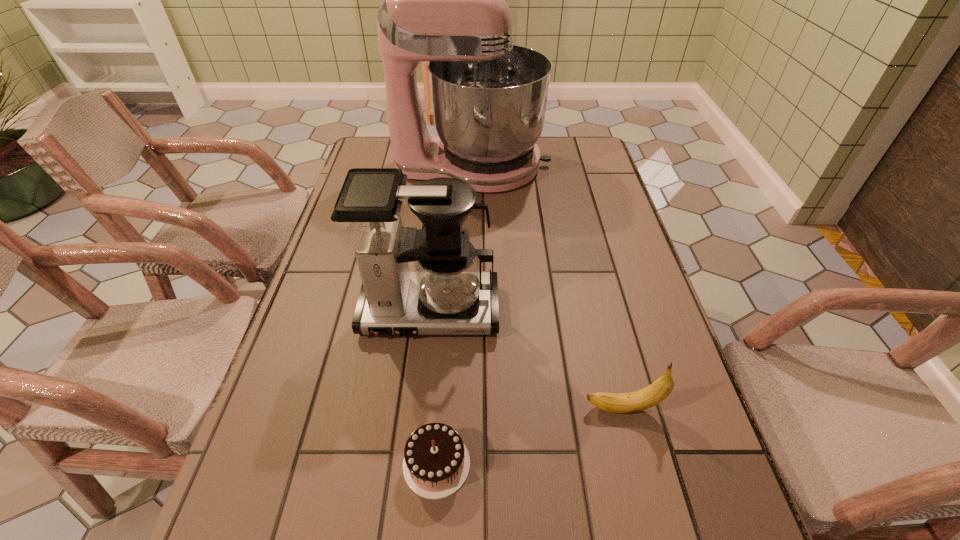
I want to click on vacant space at the left edge, so click(x=275, y=470).

In order to click on vacant space at the right edge of the desktop in this screenshot , I will do `click(597, 277)`.

Locate an element on the screen. free space between the banana and the shortest object is located at coordinates (530, 436).

Locate an element on the screen. This screenshot has height=540, width=960. empty space between the second nearest object and the nearest object is located at coordinates (530, 436).

The width and height of the screenshot is (960, 540). I want to click on unoccupied position between the nearest object and the second farthest object, so click(x=433, y=388).

At what (x,y) coordinates should I click in order to perform the action: click on empty space between the mixer and the third farthest object. Please return your answer as a coordinate pair (x, y). This screenshot has width=960, height=540. Looking at the image, I should click on click(x=548, y=287).

Locate an element on the screen. unoccupied position between the second shortest object and the tallest object is located at coordinates (548, 287).

In order to click on the third closest object to the shortest object in this screenshot , I will do `click(443, 0)`.

What are the coordinates of `the closest object to the second nearest object` in the screenshot? It's located at (447, 294).

Locate an element on the screen. vacant point that satisfies the following two spatial constraints: 1. at the start of the peel on the third farthest object; 2. on the front side of the chocolate cake is located at coordinates (637, 464).